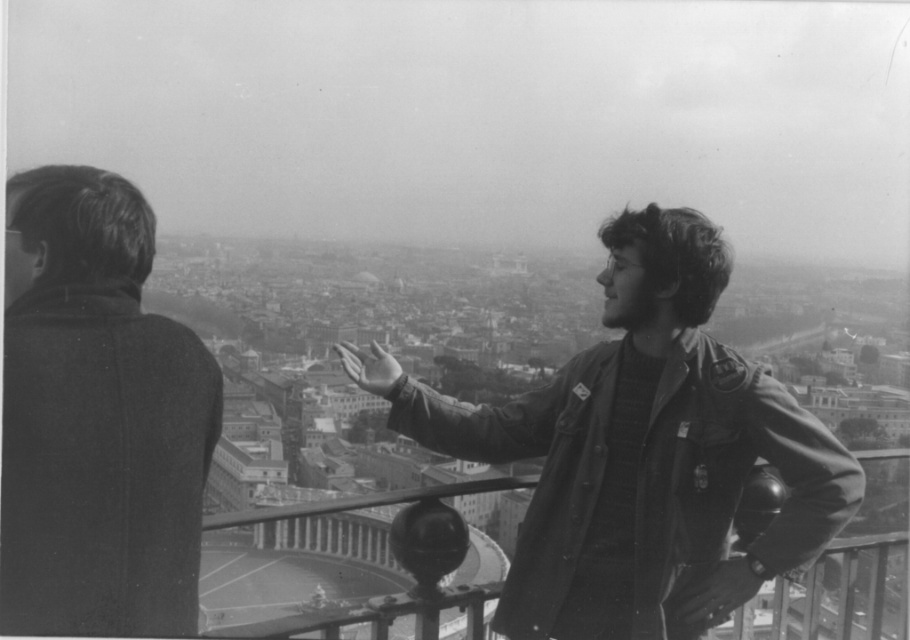
Question: Is the position of leather jacket at center more distant than that of coarse wool coat at left?

Choices:
 (A) yes
 (B) no

Answer: (A)

Question: Does leather jacket at center have a greater width compared to coarse wool coat at left?

Choices:
 (A) no
 (B) yes

Answer: (B)

Question: Which point appears closest to the camera in this image?

Choices:
 (A) (16, 320)
 (B) (650, 637)

Answer: (A)

Question: Which point is closer to the camera?

Choices:
 (A) coarse wool coat at left
 (B) leather jacket at center

Answer: (A)

Question: Which point is closer to the camera taking this photo?

Choices:
 (A) (139, 512)
 (B) (617, 273)

Answer: (A)

Question: Is leather jacket at center smaller than coarse wool coat at left?

Choices:
 (A) yes
 (B) no

Answer: (B)